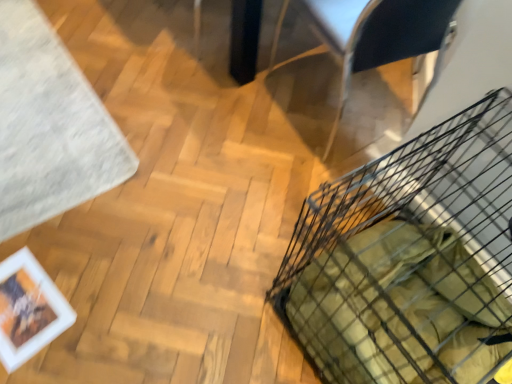
At what (x,y) coordinates should I click in order to perform the action: click on vacant space that is in between metallic silver armchair at upper right and white matte picture frame at lower left. Please return your answer as a coordinate pair (x, y). Looking at the image, I should click on (188, 195).